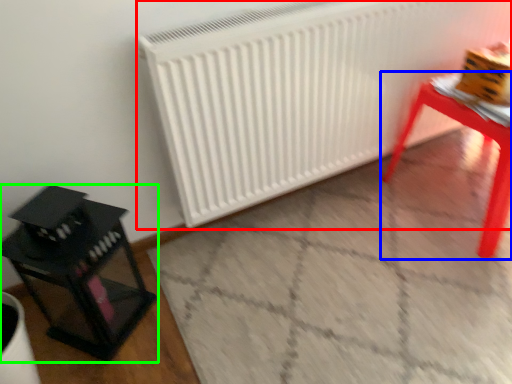
Question: Which is farther away from radiator (highlighted by a red box)? table (highlighted by a blue box) or furniture (highlighted by a green box)?

Choices:
 (A) table
 (B) furniture

Answer: (B)